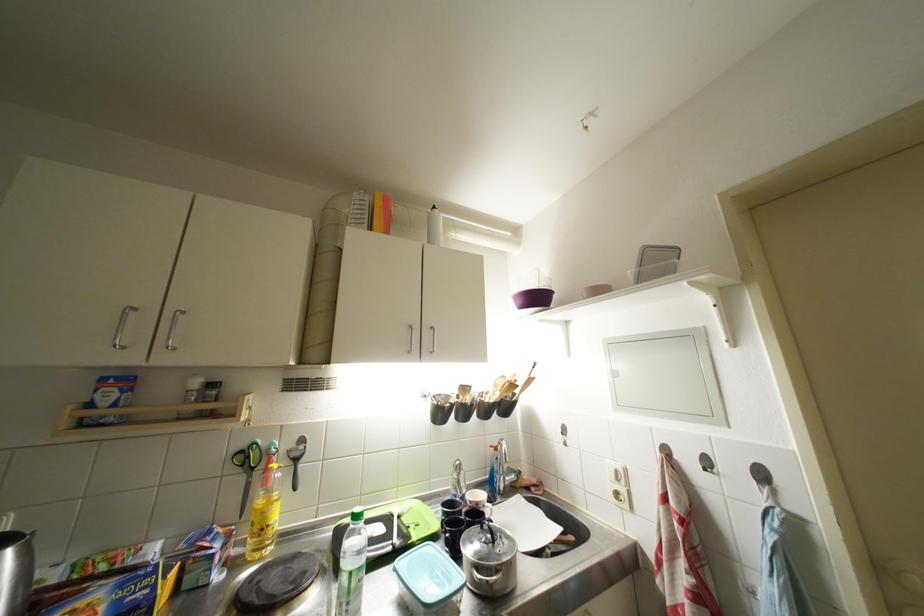
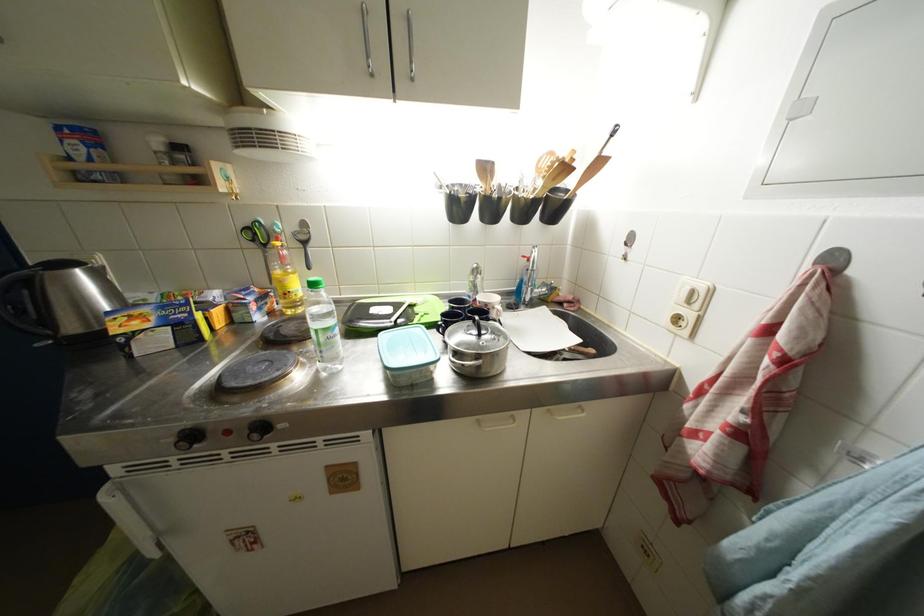
The point at (359, 589) is marked in the first image. Where is the corresponding point in the second image?

(329, 344)